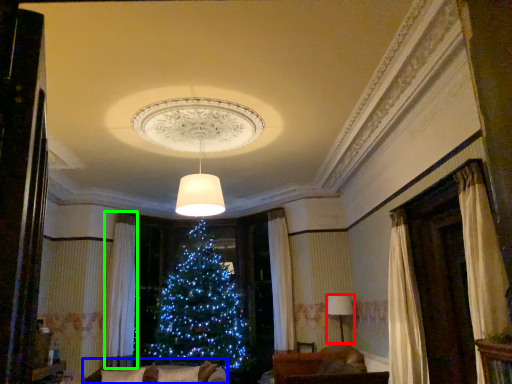
Question: Based on their relative distances, which object is farther from lamp (highlighted by a red box)? Choose from couch (highlighted by a blue box) and curtain (highlighted by a green box).

Choices:
 (A) couch
 (B) curtain

Answer: (B)